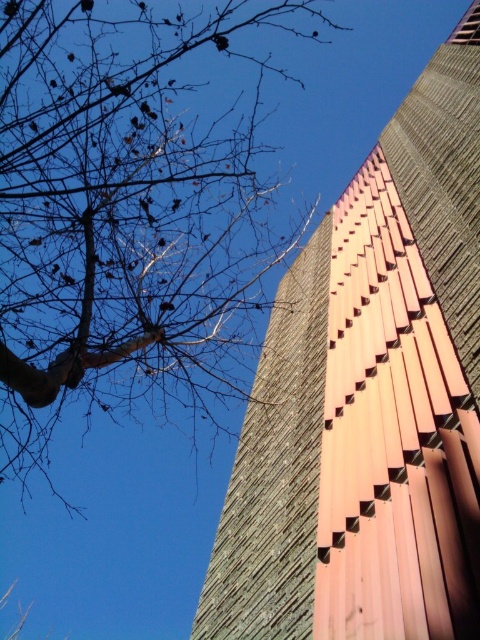
Question: Is rustic wood paneling at upper right thinner than bare branches at upper left?

Choices:
 (A) yes
 (B) no

Answer: (A)

Question: Can you confirm if rustic wood paneling at upper right is smaller than bare branches at upper left?

Choices:
 (A) yes
 (B) no

Answer: (A)

Question: Can you confirm if rustic wood paneling at upper right is positioned below bare branches at upper left?

Choices:
 (A) yes
 (B) no

Answer: (B)